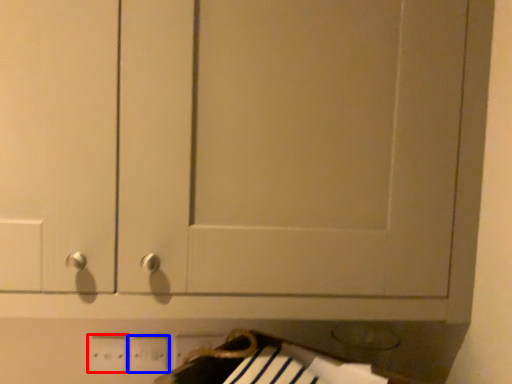
Question: Among these objects, which one is nearest to the camera, electric outlet (highlighted by a red box) or electric outlet (highlighted by a blue box)?

Choices:
 (A) electric outlet
 (B) electric outlet

Answer: (A)